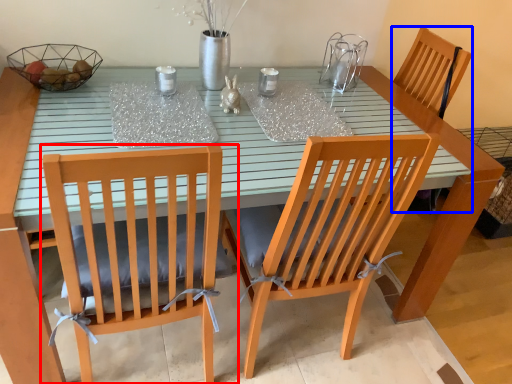
Question: Among these objects, which one is farthest to the camera, chair (highlighted by a red box) or armchair (highlighted by a blue box)?

Choices:
 (A) chair
 (B) armchair

Answer: (B)